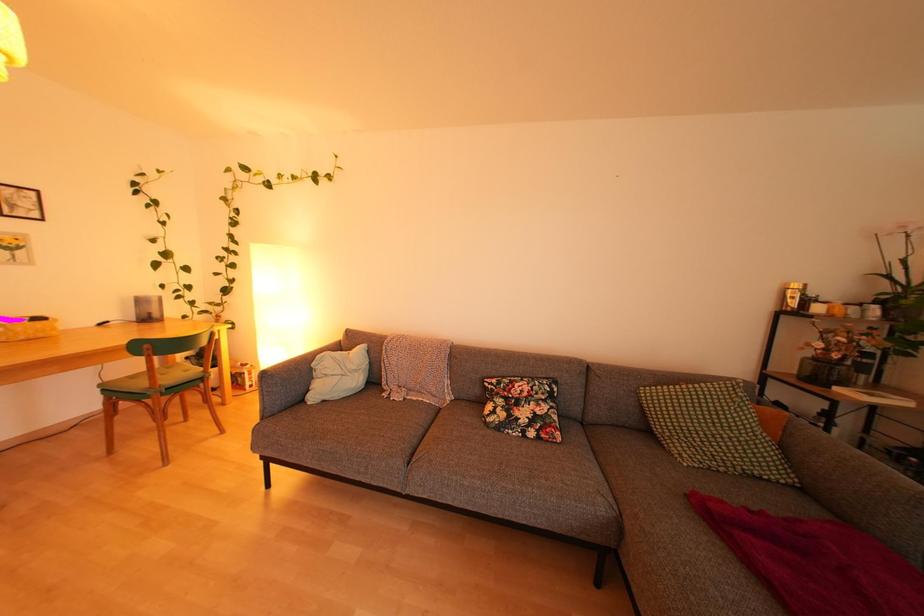
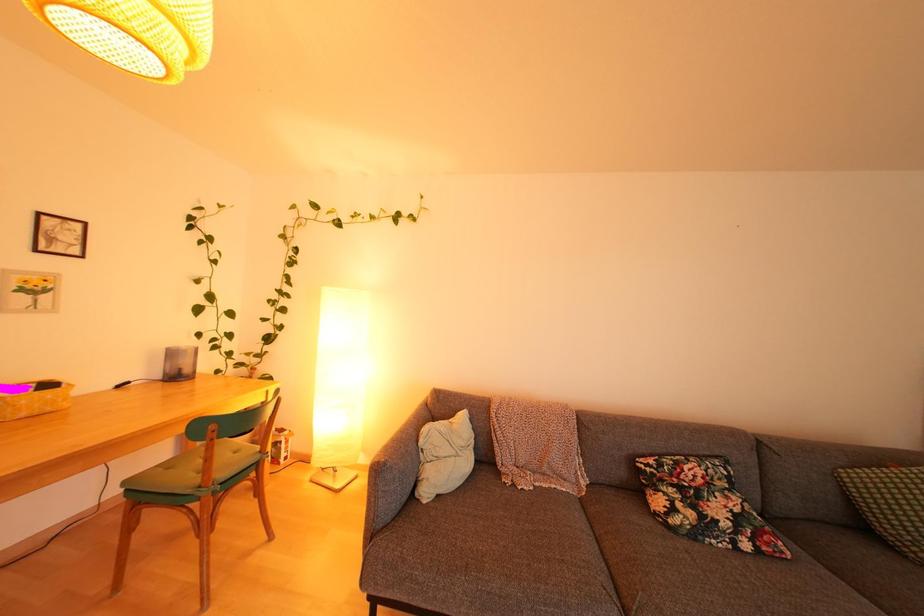
Question: The images are taken continuously from a first-person perspective. In which direction is your viewpoint rotating?

Choices:
 (A) Left
 (B) Right
 (C) Up
 (D) Down

Answer: (C)